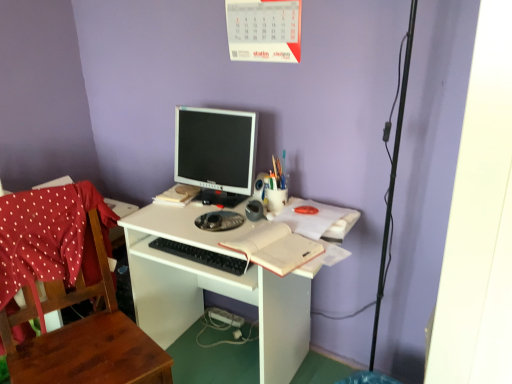
Image resolution: width=512 pixels, height=384 pixels. Find the location of `empty space that is ontop of white matte desk at center (from a real-world perspective)`. empty space that is ontop of white matte desk at center (from a real-world perspective) is located at coordinates (195, 214).